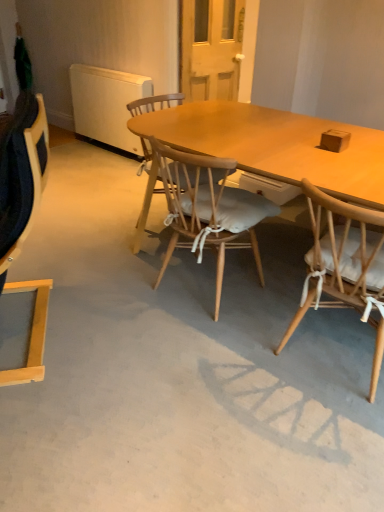
At what (x,y) coordinates should I click in order to perform the action: click on empty space that is to the right of light wood chair at left, marked as the third chair in a right-to-left arrangement. Please return your answer as a coordinate pair (x, y). Image resolution: width=384 pixels, height=512 pixels. Looking at the image, I should click on (126, 336).